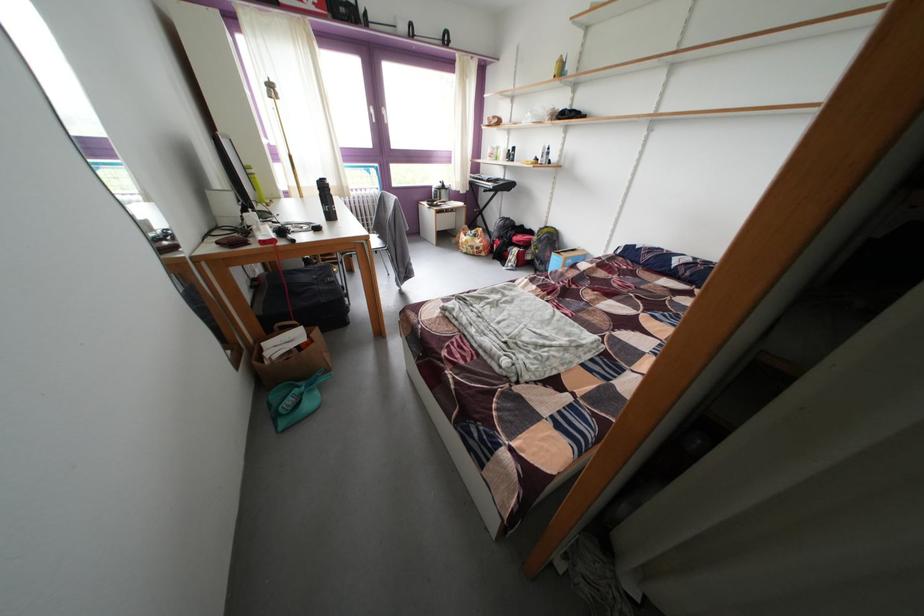
At what (x,y) coordinates should I click in order to perform the action: click on electronic keyboard. Please return your answer as a coordinate pair (x, y). The image size is (924, 616). Looking at the image, I should click on (485, 180).